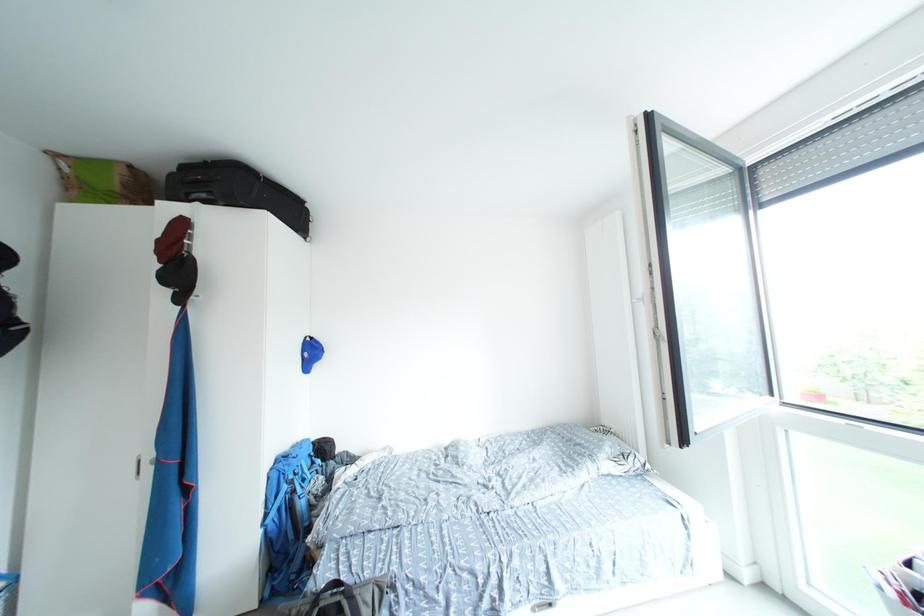
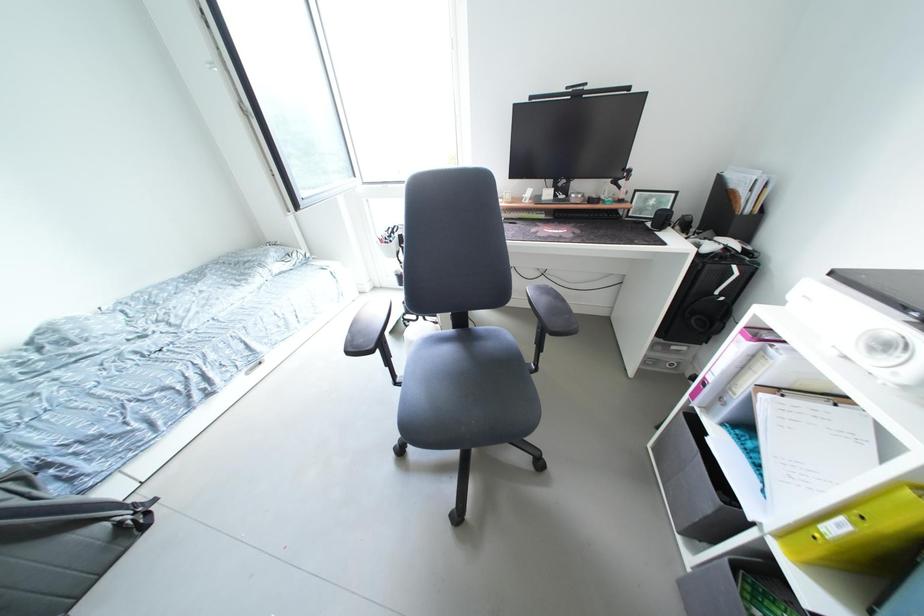
The first image is from the beginning of the video and the second image is from the end. How did the camera likely rotate when shooting the video?

The camera rotated toward right-down.